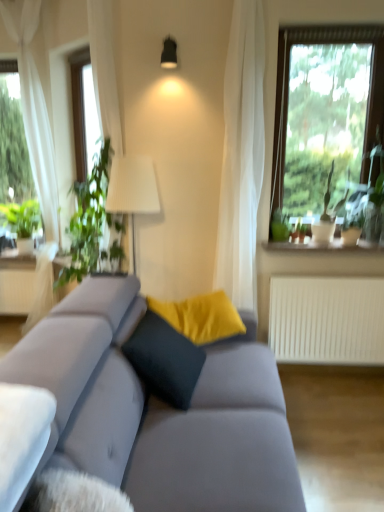
Describe the element at coordinates (327, 320) in the screenshot. I see `white matte radiator at right` at that location.

Find the location of a particular element. white sheer curtain at left is located at coordinates (34, 109).

The height and width of the screenshot is (512, 384). Describe the element at coordinates (159, 411) in the screenshot. I see `suede gray couch at center` at that location.

Identify the location of green leafy plant at right. (280, 226).

You are a GUI agent. You are given a task and a screenshot of the screen. Output one action in this format:
    pyautogui.click(x=<x>, y=<y>)
    Task: Click on the white ceramic vase at upper right
    
    Given the screenshot: What is the action you would take?
    pyautogui.click(x=322, y=245)

Locate an element on the screen. The height and width of the screenshot is (512, 384). white matte radiator at right is located at coordinates (327, 320).

From a real-world perspective, is green leafy plant at left on top of green leafy plant at right?

Yes, from a real-world perspective, green leafy plant at left is on top of green leafy plant at right.

Is green leafy plant at left facing towards green leafy plant at right?

No, green leafy plant at left is not aimed at green leafy plant at right.

Looking at their sizes, would you say green leafy plant at left is wider or thinner than green leafy plant at right?

green leafy plant at left is wider than green leafy plant at right.

Which is behind, green leafy plant at left or green leafy plant at right?

green leafy plant at right.

From the image's perspective, is white sheer curtain at left beneath white matte radiator at right?

Actually, white sheer curtain at left appears above white matte radiator at right in the image.

Can you confirm if white sheer curtain at left is taller than white matte radiator at right?

Yes, white sheer curtain at left is taller than white matte radiator at right.

In the scene shown: Considering the positions of objects white sheer curtain at left and white matte radiator at right in the image provided, who is more to the left, white sheer curtain at left or white matte radiator at right?

white sheer curtain at left is more to the left.

From a real-world perspective, which is physically above, green leafy plant at right or white sheer curtain at left?

In real-world perspective, white sheer curtain at left is above.

In the image, is green leafy plant at right positioned in front of or behind white sheer curtain at left?

Visually, green leafy plant at right is located in front of white sheer curtain at left.

Which is correct: green leafy plant at right is inside white sheer curtain at left, or outside of it?

green leafy plant at right is spatially situated outside white sheer curtain at left.

Considering the relative sizes of green leafy plant at right and white sheer curtain at left in the image provided, is green leafy plant at right thinner than white sheer curtain at left?

Correct, the width of green leafy plant at right is less than that of white sheer curtain at left.

Where is `plant located on the right of black matte lamp at upper center`? Image resolution: width=384 pixels, height=512 pixels. plant located on the right of black matte lamp at upper center is located at coordinates (280, 226).

Considering the sizes of objects black matte lamp at upper center and green leafy plant at right in the image provided, who is shorter, black matte lamp at upper center or green leafy plant at right?

With less height is black matte lamp at upper center.

Would you say black matte lamp at upper center is outside green leafy plant at right?

black matte lamp at upper center lies outside green leafy plant at right's area.

From the image's perspective, is black matte lamp at upper center positioned above or below green leafy plant at right?

From the image's perspective, black matte lamp at upper center appears above green leafy plant at right.

Is point (27, 92) closer to camera compared to point (279, 219)?

That is False.

Considering the sizes of objects white sheer curtain at left and green leafy plant at right in the image provided, who is taller, white sheer curtain at left or green leafy plant at right?

Standing taller between the two is white sheer curtain at left.

Does white sheer curtain at left come behind green leafy plant at right?

That is True.

From a real-world perspective, who is located higher, white sheer curtain at left or green leafy plant at right?

In real-world perspective, white sheer curtain at left is above.

Is green leafy plant at right inside or outside of white matte radiator at right?

green leafy plant at right is not enclosed by white matte radiator at right.

From the image's perspective, between green leafy plant at right and white matte radiator at right, who is located below?

white matte radiator at right is shown below in the image.

What's the angular difference between green leafy plant at right and white matte radiator at right's facing directions?

0.00108 degrees separate the facing orientations of green leafy plant at right and white matte radiator at right.

Considering the sizes of objects green leafy plant at right and white matte radiator at right in the image provided, who is wider, green leafy plant at right or white matte radiator at right?

white matte radiator at right is wider.

The image size is (384, 512). Find the location of `radiator that is on the right side of suede gray couch at center`. radiator that is on the right side of suede gray couch at center is located at coordinates (327, 320).

From a real-world perspective, is white matte radiator at right above or below suede gray couch at center?

white matte radiator at right is below suede gray couch at center.

Measure the distance between white matte radiator at right and suede gray couch at center.

1.04 meters.

Can you confirm if white matte radiator at right is smaller than suede gray couch at center?

Yes.

Identify the location of houseplant that is in front of the green leafy plant at right. The image size is (384, 512). (91, 222).

The image size is (384, 512). In order to click on curtain that is above the white matte radiator at right (from a real-world perspective) in this screenshot , I will do `click(34, 109)`.

Which object lies further to the anchor point white ceramic vase at upper right, green leafy plant at right or suede gray couch at center?

suede gray couch at center lies further to white ceramic vase at upper right than the other object.

Considering their positions, is green leafy plant at left positioned further to suede gray couch at center than white sheer curtain at left?

white sheer curtain at left is positioned further to the anchor suede gray couch at center.

From the image, which object appears to be nearer to white matte radiator at right, suede gray couch at center or white sheer curtain at left?

suede gray couch at center is positioned closer to the anchor white matte radiator at right.

When comparing their distances from suede gray couch at center, does white sheer curtain at left or green leafy plant at left seem further?

white sheer curtain at left.

Looking at the image, which one is located further to black matte lamp at upper center, green leafy plant at right or green leafy plant at left?

green leafy plant at right lies further to black matte lamp at upper center than the other object.

Which object lies nearer to the anchor point white matte radiator at right, white ceramic vase at upper right or suede gray couch at center?

white ceramic vase at upper right is closer to white matte radiator at right.

From the image, which object appears to be nearer to suede gray couch at center, white sheer curtain at left or white ceramic vase at upper right?

white ceramic vase at upper right is closer to suede gray couch at center.

In the scene shown: Considering their positions, is white matte radiator at right positioned closer to green leafy plant at left than white ceramic vase at upper right?

white ceramic vase at upper right lies closer to green leafy plant at left than the other object.

This screenshot has width=384, height=512. What are the coordinates of `lamp located between suede gray couch at center and white sheer curtain at left in the depth direction` in the screenshot? It's located at (169, 53).

At what (x,y) coordinates should I click in order to perform the action: click on houseplant between black matte lamp at upper center and white matte radiator at right vertically. Please return your answer as a coordinate pair (x, y). The image size is (384, 512). Looking at the image, I should click on (91, 222).

Where is `plant between white sheer curtain at left and white ceramic vase at upper right in the horizontal direction`? plant between white sheer curtain at left and white ceramic vase at upper right in the horizontal direction is located at coordinates (280, 226).

At what (x,y) coordinates should I click in order to perform the action: click on plant between suede gray couch at center and white sheer curtain at left in the front-back direction. Please return your answer as a coordinate pair (x, y). Looking at the image, I should click on (280, 226).